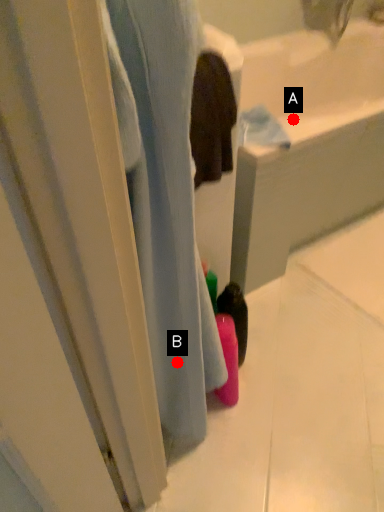
Question: Two points are circled on the image, labeled by A and B beside each circle. Among these points, which one is nearest to the camera?

Choices:
 (A) A is closer
 (B) B is closer

Answer: (B)